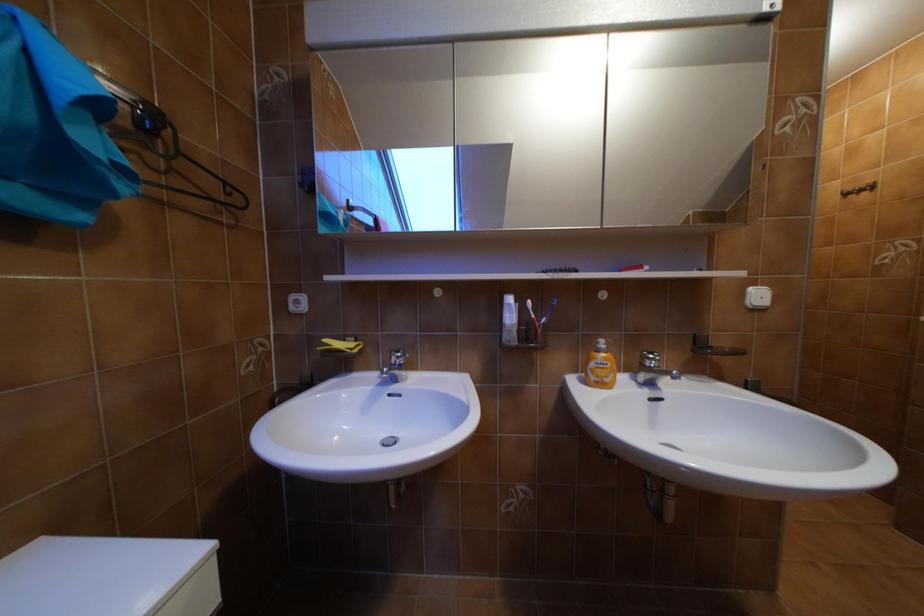
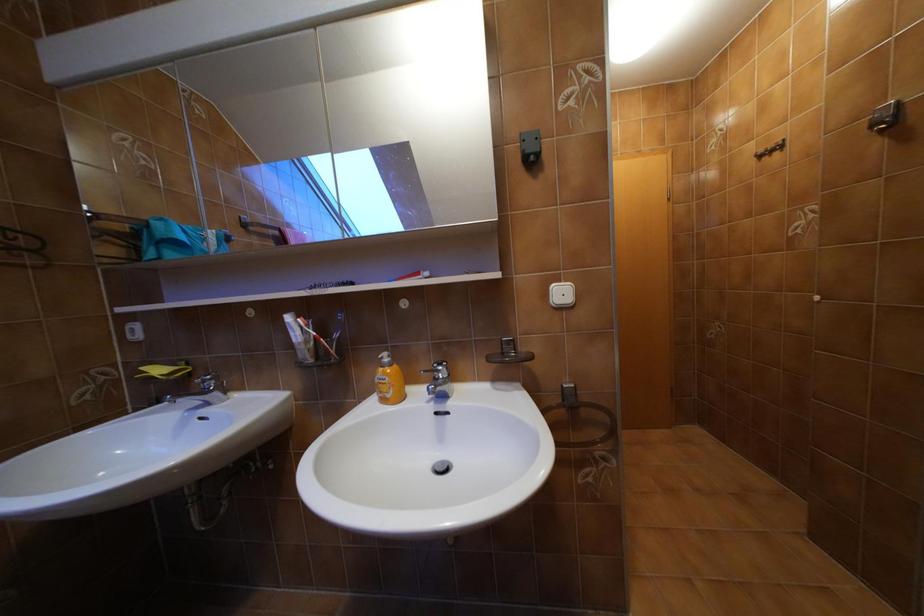
Question: The images are taken continuously from a first-person perspective. In which direction is your viewpoint rotating?

Choices:
 (A) Left
 (B) Right
 (C) Up
 (D) Down

Answer: (A)